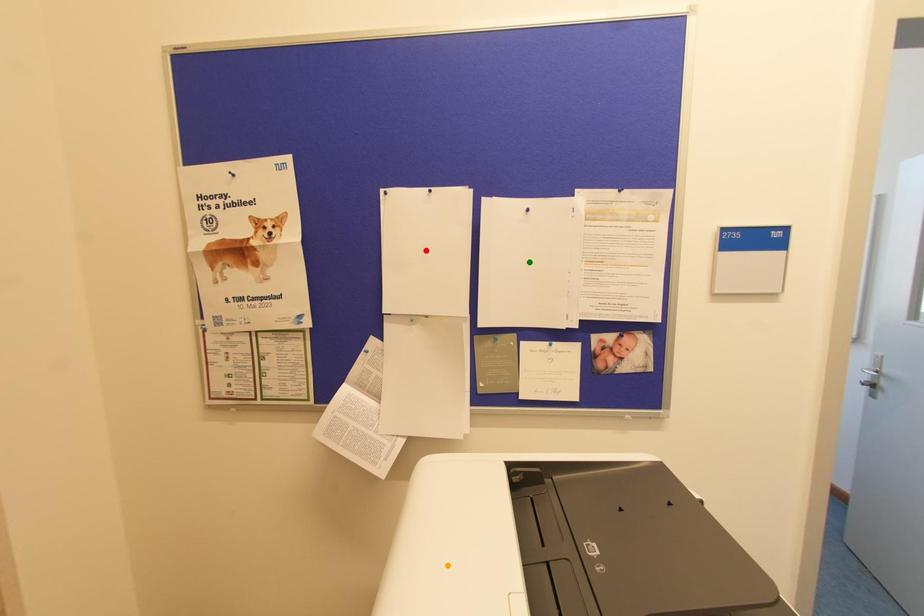
Order these from farthest to nearest:
orange point | green point | red point

1. green point
2. red point
3. orange point